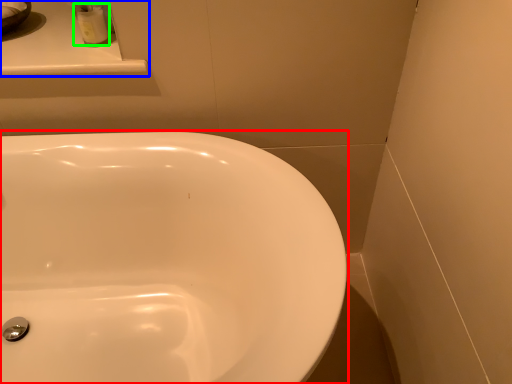
Question: Which object is the farthest from sink (highlighted by a red box)? Choose among these: counter top (highlighted by a blue box) or toiletry (highlighted by a green box).

Choices:
 (A) counter top
 (B) toiletry

Answer: (B)